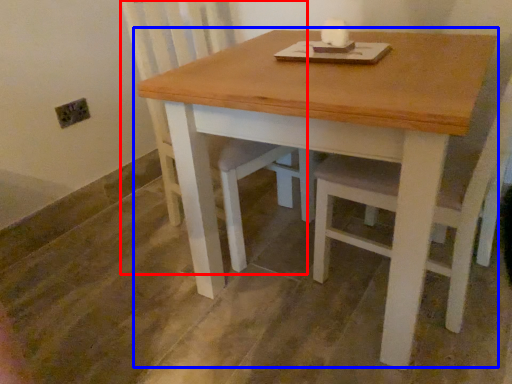
Question: Which of the following is the closest to the observer, swivel chair (highlighted by a red box) or table (highlighted by a blue box)?

Choices:
 (A) swivel chair
 (B) table

Answer: (B)